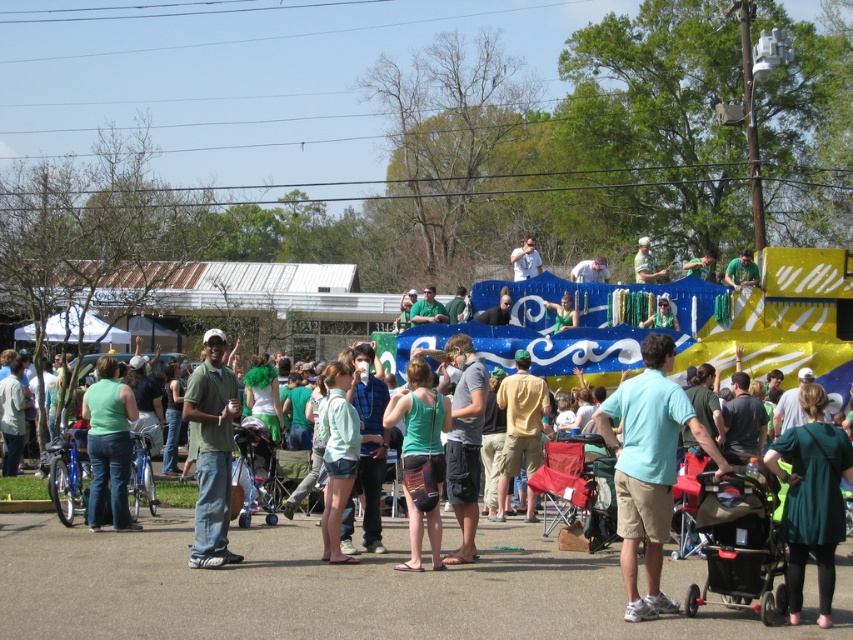
Question: Does black plastic stroller at center lie behind matte white shirt at center?

Choices:
 (A) yes
 (B) no

Answer: (B)

Question: Considering the real-world distances, which object is closest to the green dress at center?

Choices:
 (A) matte green tank top at center
 (B) green matte shirt at center

Answer: (B)

Question: Does green dress at center lie in front of black plastic stroller at center?

Choices:
 (A) yes
 (B) no

Answer: (A)

Question: Which object is farther from the camera taking this photo?

Choices:
 (A) black plastic stroller at center
 (B) matte green shirt at upper center
 (C) light blue fabric shirt at center
 (D) green fabric shorts at center

Answer: (B)

Question: Estimate the real-world distances between objects in this image. Which object is closer to the matte white shirt at center?

Choices:
 (A) black plastic stroller at center
 (B) green matte shirt at center
 (C) matte green shirt at upper center
 (D) light blue fabric shirt at center

Answer: (C)

Question: Is green dress at center smaller than green fabric shorts at center?

Choices:
 (A) yes
 (B) no

Answer: (A)